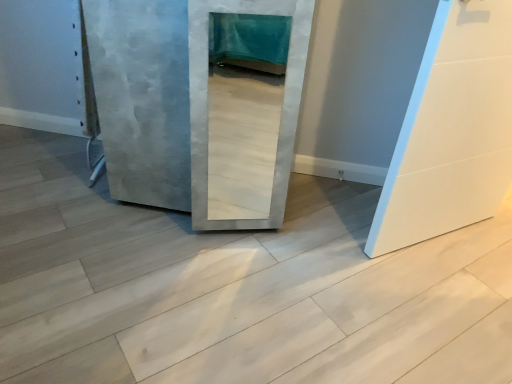
Where is `blank space to the left of concrete textured door at center, which is counted as the first door, starting from the left`? blank space to the left of concrete textured door at center, which is counted as the first door, starting from the left is located at coordinates (50, 197).